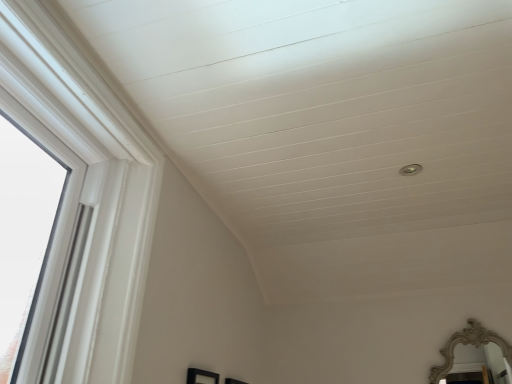
Where is `black matte picture frame at lower center`? The image size is (512, 384). black matte picture frame at lower center is located at coordinates (201, 377).

This screenshot has height=384, width=512. What do you see at coordinates (201, 377) in the screenshot?
I see `black matte picture frame at lower center` at bounding box center [201, 377].

This screenshot has width=512, height=384. I want to click on black matte picture frame at lower center, so click(201, 377).